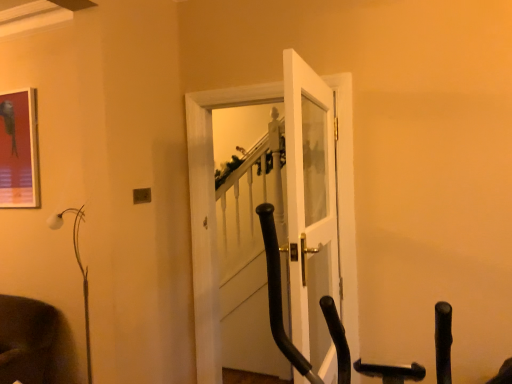
What do you see at coordinates (80, 271) in the screenshot? The image size is (512, 384). I see `white matte floor lamp at left` at bounding box center [80, 271].

Image resolution: width=512 pixels, height=384 pixels. Describe the element at coordinates (311, 211) in the screenshot. I see `white glass door at center, the 1th door positioned from the front` at that location.

Locate an element on the screen. This screenshot has width=512, height=384. white glossy door at center, placed as the 1th door when sorted from back to front is located at coordinates (210, 213).

Considering the relative positions of white glass door at center, the 1th door positioned from the front, and white glossy door at center, which is the 2th door from front to back, in the image provided, is white glass door at center, the 1th door positioned from the front, to the left or to the right of white glossy door at center, which is the 2th door from front to back,?

From the image, it's evident that white glass door at center, the 1th door positioned from the front, is to the right of white glossy door at center, which is the 2th door from front to back.

Is white glossy door at center, placed as the 1th door when sorted from back to front, inside white glass door at center, the 1th door positioned from the front?

No.

From a real-world perspective, is white glass door at center, the 2th door viewed from the back, below white glossy door at center, which is the 2th door from front to back?

No.

Considering the sizes of white glass door at center, the 2th door viewed from the back, and white glossy door at center, which is the 2th door from front to back, in the image, is white glass door at center, the 2th door viewed from the back, taller or shorter than white glossy door at center, which is the 2th door from front to back,?

In the image, white glass door at center, the 2th door viewed from the back, appears to be shorter than white glossy door at center, which is the 2th door from front to back.

Where is `door on the left of white glass door at center, the 2th door viewed from the back`? The height and width of the screenshot is (384, 512). door on the left of white glass door at center, the 2th door viewed from the back is located at coordinates (210, 213).

What's the angular difference between white glossy door at center, which is the 2th door from front to back, and white glass door at center, the 1th door positioned from the front,'s facing directions?

87 degrees separate the facing orientations of white glossy door at center, which is the 2th door from front to back, and white glass door at center, the 1th door positioned from the front.

Considering the sizes of objects white glossy door at center, which is the 2th door from front to back, and white glass door at center, the 1th door positioned from the front, in the image provided, who is shorter, white glossy door at center, which is the 2th door from front to back, or white glass door at center, the 1th door positioned from the front,?

white glass door at center, the 1th door positioned from the front, is shorter.

Relative to white glass door at center, the 2th door viewed from the back, is white glossy door at center, placed as the 1th door when sorted from back to front, in front or behind?

white glossy door at center, placed as the 1th door when sorted from back to front, is positioned farther from the viewer than white glass door at center, the 2th door viewed from the back.

Would you say metallic glossy picture frame at upper left is outside white glass door at center, the 1th door positioned from the front?

Indeed, metallic glossy picture frame at upper left is completely outside white glass door at center, the 1th door positioned from the front.

From the image's perspective, which one is positioned higher, metallic glossy picture frame at upper left or white glass door at center, the 1th door positioned from the front?

metallic glossy picture frame at upper left.

In the scene shown: Considering the relative sizes of metallic glossy picture frame at upper left and white glass door at center, the 2th door viewed from the back, in the image provided, is metallic glossy picture frame at upper left shorter than white glass door at center, the 2th door viewed from the back,?

Correct, metallic glossy picture frame at upper left is not as tall as white glass door at center, the 2th door viewed from the back.

Does metallic glossy picture frame at upper left have a lesser width compared to white glass door at center, the 1th door positioned from the front?

Yes, metallic glossy picture frame at upper left is thinner than white glass door at center, the 1th door positioned from the front.

In the scene shown: Could you tell me if white matte floor lamp at left is facing metallic glossy picture frame at upper left?

No, white matte floor lamp at left is not facing towards metallic glossy picture frame at upper left.

Does white matte floor lamp at left appear on the left side of metallic glossy picture frame at upper left?

Incorrect, white matte floor lamp at left is not on the left side of metallic glossy picture frame at upper left.

Who is shorter, white matte floor lamp at left or metallic glossy picture frame at upper left?

With less height is metallic glossy picture frame at upper left.

Can you tell me how much white matte floor lamp at left and metallic glossy picture frame at upper left differ in facing direction?

They differ by 1.56 degrees in their facing directions.

Is metallic glossy picture frame at upper left oriented away from white glossy door at center, which is the 2th door from front to back?

metallic glossy picture frame at upper left does not have its back to white glossy door at center, which is the 2th door from front to back.

Starting from the metallic glossy picture frame at upper left, which door is the 1st one in front? Please provide its 2D coordinates.

[(210, 213)]

In the scene shown: From their relative heights in the image, would you say metallic glossy picture frame at upper left is taller or shorter than white glossy door at center, which is the 2th door from front to back?

Clearly, metallic glossy picture frame at upper left is shorter compared to white glossy door at center, which is the 2th door from front to back.

Which is more to the left, metallic glossy picture frame at upper left or white glossy door at center, which is the 2th door from front to back?

From the viewer's perspective, metallic glossy picture frame at upper left appears more on the left side.

Choose the correct answer: Is white glossy door at center, which is the 2th door from front to back, inside metallic glossy picture frame at upper left or outside it?

white glossy door at center, which is the 2th door from front to back, lies outside metallic glossy picture frame at upper left.

From a real-world perspective, which object rests below the other?

white glossy door at center, placed as the 1th door when sorted from back to front, from a real-world perspective.

From the image's perspective, between white glossy door at center, placed as the 1th door when sorted from back to front, and metallic glossy picture frame at upper left, which one is located above?

metallic glossy picture frame at upper left appears higher in the image.

Who is taller, white glossy door at center, placed as the 1th door when sorted from back to front, or metallic glossy picture frame at upper left?

white glossy door at center, placed as the 1th door when sorted from back to front.

In order to click on the 1st door above the white matte floor lamp at left (from a real-world perspective) in this screenshot , I will do `click(210, 213)`.

Which of these two, white matte floor lamp at left or white glossy door at center, placed as the 1th door when sorted from back to front, is smaller?

Smaller between the two is white matte floor lamp at left.

Is point (85, 323) positioned after point (347, 116)?

Yes.

Between white matte floor lamp at left and white glossy door at center, placed as the 1th door when sorted from back to front, which one has larger width?

white matte floor lamp at left is wider.

Where is `door below the white glass door at center, the 2th door viewed from the back (from a real-world perspective)`? The image size is (512, 384). door below the white glass door at center, the 2th door viewed from the back (from a real-world perspective) is located at coordinates (210, 213).

Locate an element on the screen. The image size is (512, 384). door lying below the white glass door at center, the 2th door viewed from the back (from the image's perspective) is located at coordinates (210, 213).

Considering their positions, is white glossy door at center, which is the 2th door from front to back, positioned closer to metallic glossy picture frame at upper left than white glass door at center, the 2th door viewed from the back?

white glossy door at center, which is the 2th door from front to back, is positioned closer to the anchor metallic glossy picture frame at upper left.

Looking at the image, which one is located closer to white glass door at center, the 1th door positioned from the front, white glossy door at center, placed as the 1th door when sorted from back to front, or white matte floor lamp at left?

The object closer to white glass door at center, the 1th door positioned from the front, is white glossy door at center, placed as the 1th door when sorted from back to front.

Based on the photo, when comparing their distances from white matte floor lamp at left, does metallic glossy picture frame at upper left or white glossy door at center, placed as the 1th door when sorted from back to front, seem further?

white glossy door at center, placed as the 1th door when sorted from back to front.

When comparing their distances from white glossy door at center, placed as the 1th door when sorted from back to front, does metallic glossy picture frame at upper left or white matte floor lamp at left seem closer?

white matte floor lamp at left is positioned closer to the anchor white glossy door at center, placed as the 1th door when sorted from back to front.

Estimate the real-world distances between objects in this image. Which object is further from metallic glossy picture frame at upper left, white matte floor lamp at left or white glossy door at center, placed as the 1th door when sorted from back to front?

Based on the image, white glossy door at center, placed as the 1th door when sorted from back to front, appears to be further to metallic glossy picture frame at upper left.

Based on the photo, considering their positions, is white glass door at center, the 2th door viewed from the back, positioned closer to metallic glossy picture frame at upper left than white matte floor lamp at left?

Based on the image, white matte floor lamp at left appears to be nearer to metallic glossy picture frame at upper left.

Which object lies nearer to the anchor point white glossy door at center, placed as the 1th door when sorted from back to front, metallic glossy picture frame at upper left or white glass door at center, the 2th door viewed from the back?

white glass door at center, the 2th door viewed from the back, lies closer to white glossy door at center, placed as the 1th door when sorted from back to front, than the other object.

When comparing their distances from white glass door at center, the 1th door positioned from the front, does metallic glossy picture frame at upper left or white glossy door at center, placed as the 1th door when sorted from back to front, seem further?

Based on the image, metallic glossy picture frame at upper left appears to be further to white glass door at center, the 1th door positioned from the front.

I want to click on door between metallic glossy picture frame at upper left and white glass door at center, the 2th door viewed from the back, from left to right, so click(210, 213).

Locate an element on the screen. This screenshot has height=384, width=512. door between white matte floor lamp at left and white glass door at center, the 1th door positioned from the front, in the horizontal direction is located at coordinates click(210, 213).

At what (x,y) coordinates should I click in order to perform the action: click on lamp situated between metallic glossy picture frame at upper left and white glass door at center, the 1th door positioned from the front, from left to right. Please return your answer as a coordinate pair (x, y). Looking at the image, I should click on (80, 271).

The width and height of the screenshot is (512, 384). Identify the location of lamp located between metallic glossy picture frame at upper left and white glossy door at center, which is the 2th door from front to back, in the left-right direction. (80, 271).